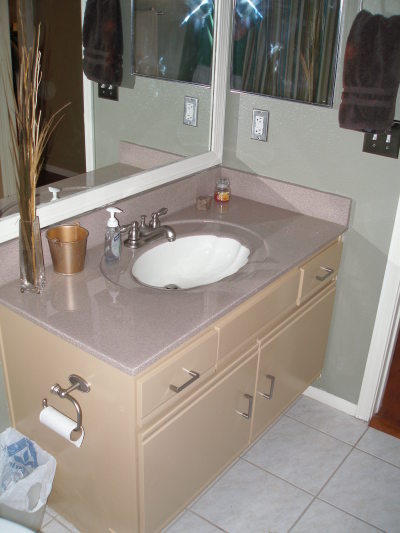
What are the coordinates of `tile floor` in the screenshot? It's located at (313, 456), (272, 500), (356, 498).